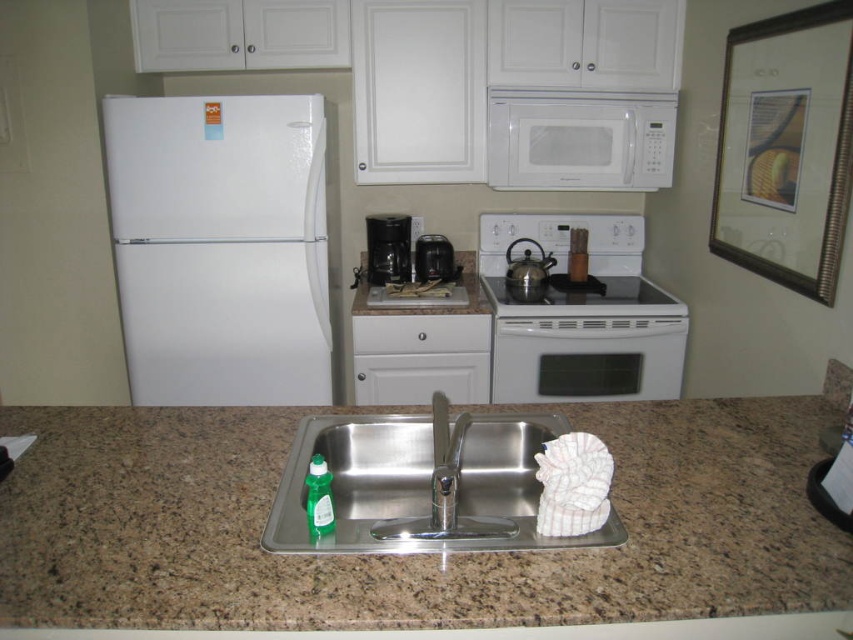
What are the coordinates of the polished stainless steel faucet at center?

The polished stainless steel faucet at center is located at coordinates point (x=445, y=461).

You are organizing the kitchen and need to place a new appliance between the stainless steel sink at center and the white matte microwave at upper center. Based on their positions, where should the appliance be placed?

The stainless steel sink at center is to the left of the white matte microwave at upper center, so the appliance should be placed in between them, to the right of the sink and left of the microwave.

You are a kitchen designer planning to install a new faucet and coffee maker in this kitchen. Based on the current layout, which object, the polished stainless steel faucet at center or the black plastic coffee maker at center, is closer to the observer?

The polished stainless steel faucet at center is closer to the observer because it is in front of the black plastic coffee maker at center.